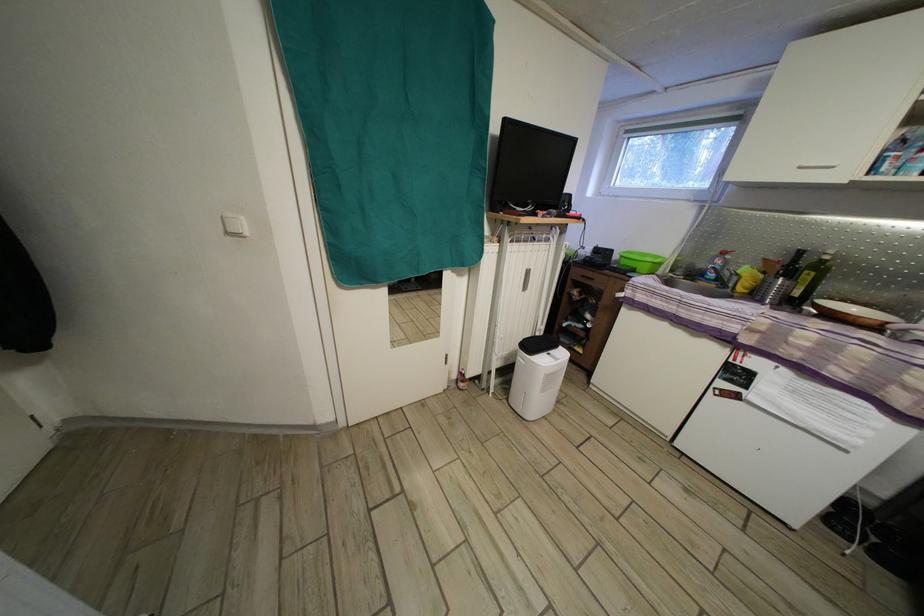
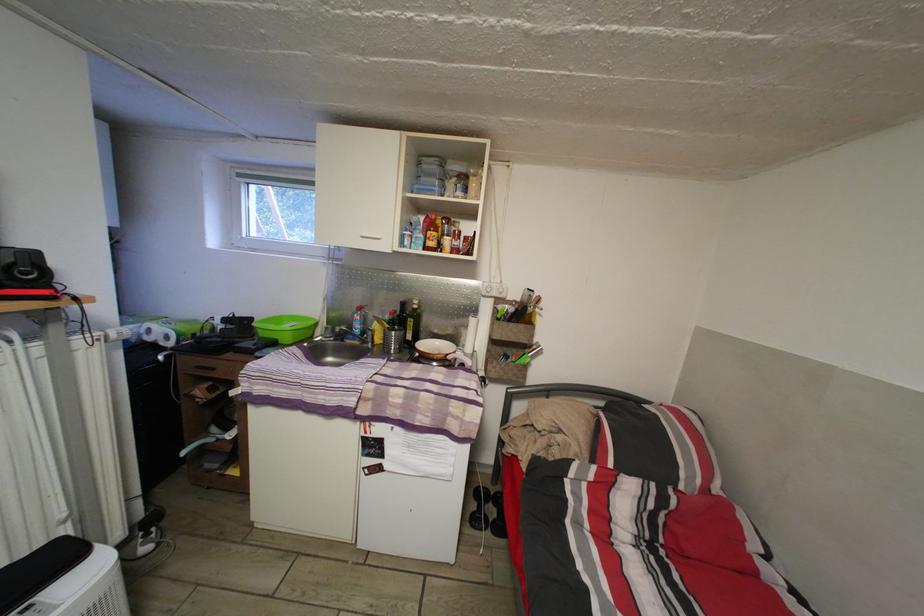
In the second image, find the point that corresponds to (x=876, y=519) in the first image.

(493, 498)